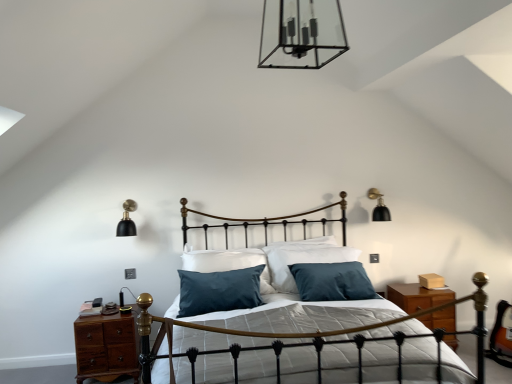
Question: Is clear glass chandelier at upper center, which ranks as the third light fixture in back-to-front order, positioned with its back to black matte wall sconce at upper right, the 1th light fixture viewed from the right?

Choices:
 (A) no
 (B) yes

Answer: (A)

Question: Can you confirm if clear glass chandelier at upper center, the second light fixture positioned from the right, is thinner than black matte wall sconce at upper right, the 1th light fixture viewed from the right?

Choices:
 (A) no
 (B) yes

Answer: (A)

Question: Is clear glass chandelier at upper center, placed as the first light fixture when sorted from top to bottom, outside of black matte wall sconce at upper right, which is counted as the second light fixture, starting from the bottom?

Choices:
 (A) yes
 (B) no

Answer: (A)

Question: Does clear glass chandelier at upper center, arranged as the 3th light fixture when ordered from the bottom, appear on the right side of black matte wall sconce at upper right, which is counted as the second light fixture, starting from the bottom?

Choices:
 (A) yes
 (B) no

Answer: (B)

Question: Can you confirm if clear glass chandelier at upper center, positioned as the 1th light fixture in front-to-back order, is bigger than black matte wall sconce at upper right, which is the third light fixture in left-to-right order?

Choices:
 (A) yes
 (B) no

Answer: (A)

Question: Does clear glass chandelier at upper center, which ranks as the third light fixture in back-to-front order, touch black matte wall sconce at upper right, which is counted as the second light fixture, starting from the bottom?

Choices:
 (A) yes
 (B) no

Answer: (B)

Question: Is black matte wall sconce at upper right, the third light fixture positioned from the front, not near brown wood nightstand at left?

Choices:
 (A) no
 (B) yes

Answer: (B)

Question: Can you confirm if black matte wall sconce at upper right, the 1th light fixture from the back, is smaller than brown wood nightstand at left?

Choices:
 (A) no
 (B) yes

Answer: (B)

Question: Is black matte wall sconce at upper right, the third light fixture positioned from the front, next to brown wood nightstand at left and touching it?

Choices:
 (A) yes
 (B) no

Answer: (B)

Question: Considering the relative positions of black matte wall sconce at upper right, the 1th light fixture viewed from the right, and brown wood nightstand at left in the image provided, is black matte wall sconce at upper right, the 1th light fixture viewed from the right, in front of brown wood nightstand at left?

Choices:
 (A) yes
 (B) no

Answer: (B)

Question: Is black matte wall sconce at upper right, which is the third light fixture in left-to-right order, to the right of brown wood nightstand at left from the viewer's perspective?

Choices:
 (A) yes
 (B) no

Answer: (A)

Question: Considering the relative sizes of black matte wall sconce at upper right, the 1th light fixture viewed from the right, and brown wood nightstand at left in the image provided, is black matte wall sconce at upper right, the 1th light fixture viewed from the right, shorter than brown wood nightstand at left?

Choices:
 (A) no
 (B) yes

Answer: (B)

Question: From the image's perspective, is clear glass chandelier at upper center, arranged as the 3th light fixture when ordered from the bottom, under gold wrought iron bed frame at center?

Choices:
 (A) no
 (B) yes

Answer: (A)